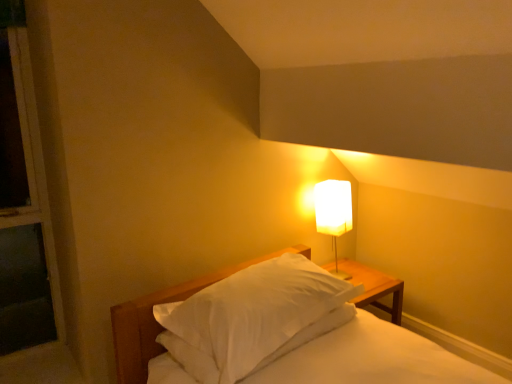
Question: Considering the positions of white soft pillow at center and white fabric lampshade at upper right in the image, is white soft pillow at center wider or thinner than white fabric lampshade at upper right?

Choices:
 (A) thin
 (B) wide

Answer: (B)

Question: Is white soft pillow at center to the left or to the right of white fabric lampshade at upper right in the image?

Choices:
 (A) left
 (B) right

Answer: (A)

Question: Estimate the real-world distances between objects in this image. Which object is closer to the white fabric lampshade at upper right?

Choices:
 (A) white matte bed at center
 (B) white soft pillow at center

Answer: (A)

Question: Which of these objects is positioned farthest from the white matte bed at center?

Choices:
 (A) white soft pillow at center
 (B) white fabric lampshade at upper right

Answer: (B)